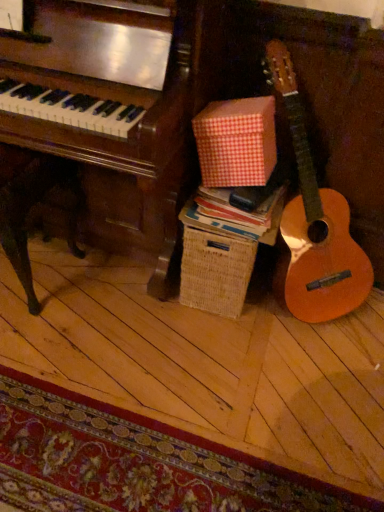
In order to click on free spot above carpeted mat at lower left (from a real-world perspective) in this screenshot , I will do `click(105, 451)`.